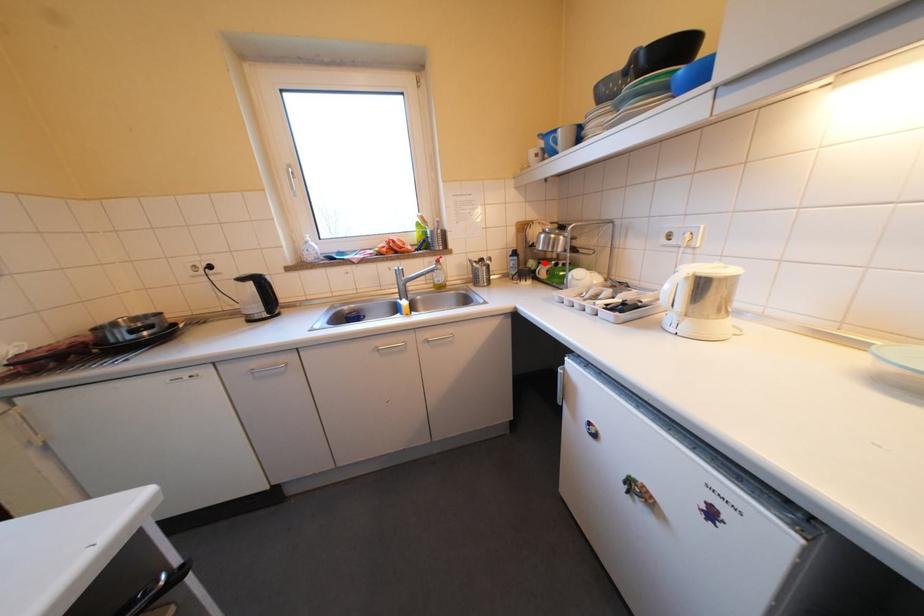
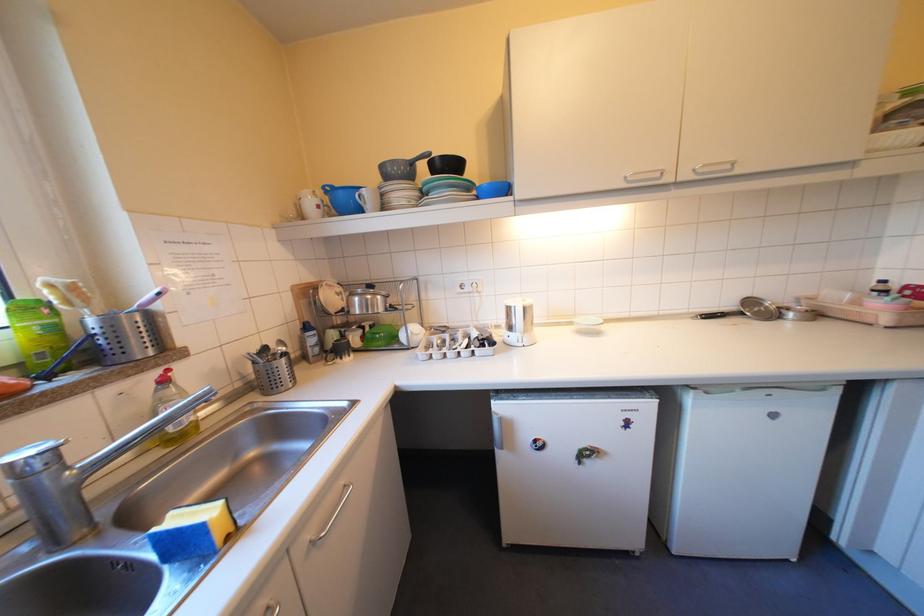
Locate, in the second image, the point that corresponds to the highlighted location in the first image.

(346, 334)